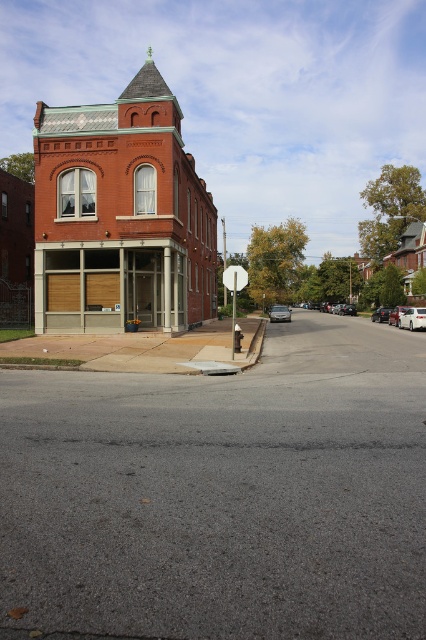
You are standing on the sidewalk in front of the red brick building and want to walk towards the two points marked in the image. Which point, point (423,307) or point (380,321), will you reach first?

You will reach point (423,307) first because it is closer to you than point (380,321).

You are a pedestrian standing on the sidewalk in front of the building and want to cross the street. You see a metallic silver sedan at center and a shiny black sedan at center. Which car is closer to the building?

The metallic silver sedan at center is closer to the building because it is positioned to the left of the shiny black sedan at center, and since the stop sign and sidewalk are near the corner, the left side would be closer to the building.

You are a pedestrian standing on the sidewalk in front of the building. You see a metallic silver sedan at center and a shiny black sedan at center. Which one is closer to the ground?

The metallic silver sedan at center is located below shiny black sedan at center, so it is closer to the ground.